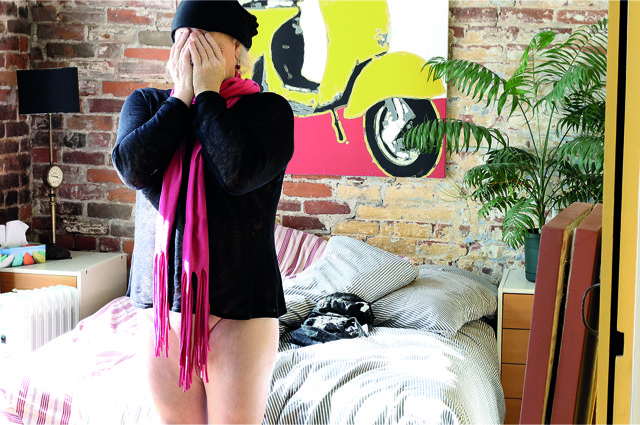
In order to click on radiator in this screenshot , I will do `click(42, 318)`.